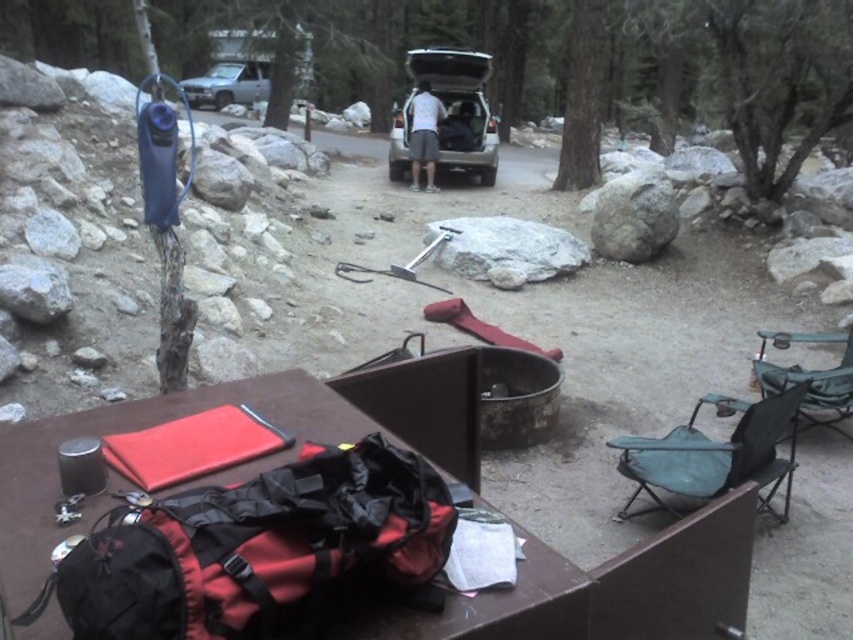
Question: Which of these objects is positioned closest to the matte silver suv at center?

Choices:
 (A) green fabric chair at lower right
 (B) rubberized red duffel bag at center
 (C) green fabric folding chair at right

Answer: (C)

Question: Which point is farther to the camera?

Choices:
 (A) rubberized red duffel bag at center
 (B) green fabric folding chair at right
 (C) matte silver suv at center

Answer: (C)

Question: Does rubberized red duffel bag at center have a greater width compared to green fabric chair at lower right?

Choices:
 (A) no
 (B) yes

Answer: (B)

Question: Which point is closer to the camera?

Choices:
 (A) green fabric folding chair at right
 (B) rubberized red duffel bag at center
 (C) green fabric chair at lower right

Answer: (B)

Question: Can you confirm if green fabric chair at lower right is smaller than matte silver suv at center?

Choices:
 (A) yes
 (B) no

Answer: (A)

Question: In this image, where is green fabric chair at lower right located relative to green fabric folding chair at right?

Choices:
 (A) right
 (B) left

Answer: (B)